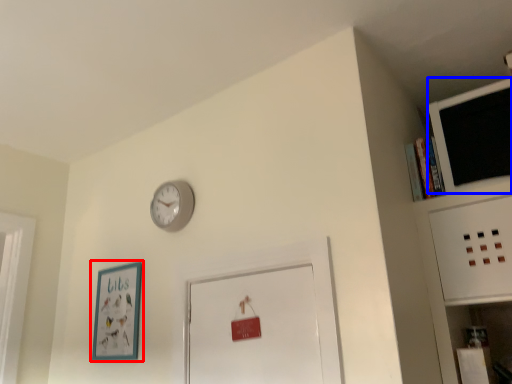
Question: Which point is further to the camera, picture frame (highlighted by a red box) or computer monitor (highlighted by a blue box)?

Choices:
 (A) picture frame
 (B) computer monitor

Answer: (A)